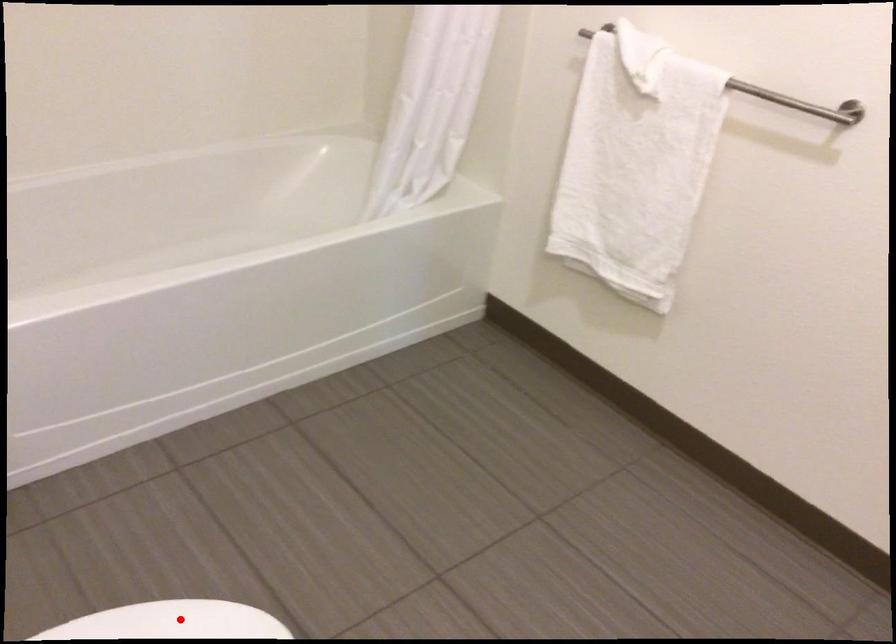
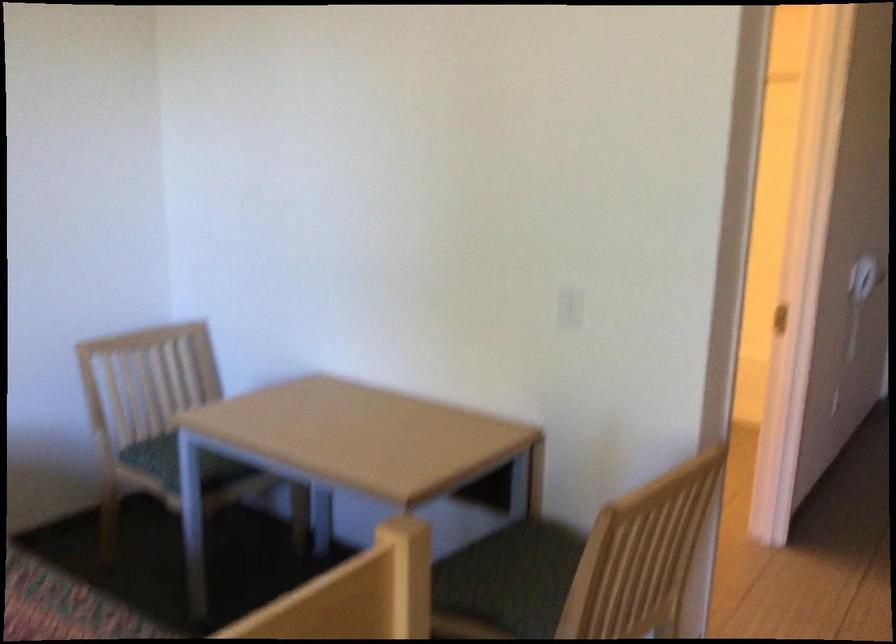
Question: I am providing you with two images of the same scene from different viewpoints. A red point is marked on the first image. Is the red point's position out of view in image 2?

Choices:
 (A) Yes
 (B) No

Answer: (A)